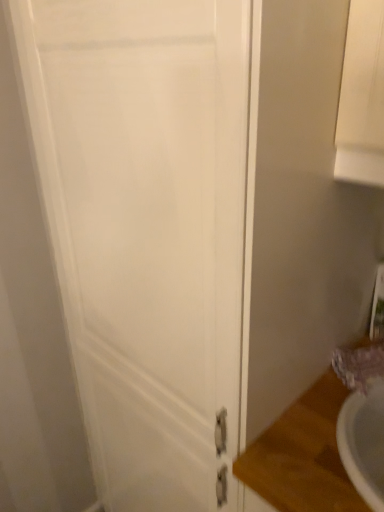
Where is `wooden counter top at lower right`? This screenshot has height=512, width=384. wooden counter top at lower right is located at coordinates (301, 455).

Who is smaller, white matte door at center or wooden counter top at lower right?

With smaller size is wooden counter top at lower right.

Can you confirm if white matte door at center is positioned to the right of wooden counter top at lower right?

No, white matte door at center is not to the right of wooden counter top at lower right.

Can you tell me how much white matte door at center and wooden counter top at lower right differ in facing direction?

white matte door at center and wooden counter top at lower right are facing 0.000102 degrees away from each other.

From the image's perspective, would you say white matte door at center is shown under wooden counter top at lower right?

No, from the image's perspective, white matte door at center is not below wooden counter top at lower right.

Considering the relative sizes of matte purple faucet at lower right and wooden counter top at lower right in the image provided, is matte purple faucet at lower right thinner than wooden counter top at lower right?

Indeed, matte purple faucet at lower right has a lesser width compared to wooden counter top at lower right.

Is matte purple faucet at lower right in front of or behind wooden counter top at lower right in the image?

matte purple faucet at lower right is behind wooden counter top at lower right.

Is wooden counter top at lower right at the back of matte purple faucet at lower right?

matte purple faucet at lower right is not turned away from wooden counter top at lower right.

Who is shorter, matte purple faucet at lower right or wooden counter top at lower right?

Standing shorter between the two is matte purple faucet at lower right.

Who is more distant, white matte door at center or matte purple faucet at lower right?

Positioned behind is matte purple faucet at lower right.

How different are the orientations of white matte door at center and matte purple faucet at lower right in degrees?

The facing directions of white matte door at center and matte purple faucet at lower right are 19.7 degrees apart.

Considering the positions of points (127, 192) and (365, 361), is point (127, 192) farther from camera compared to point (365, 361)?

No, (127, 192) is in front of (365, 361).

Is white matte door at center wider than matte purple faucet at lower right?

Indeed, white matte door at center has a greater width compared to matte purple faucet at lower right.

In the scene shown: Which is behind, matte purple faucet at lower right or white matte door at center?

Positioned behind is matte purple faucet at lower right.

What's the angular difference between matte purple faucet at lower right and white matte door at center's facing directions?

The angle between the facing direction of matte purple faucet at lower right and the facing direction of white matte door at center is 19.7 degrees.

Based on their sizes in the image, would you say matte purple faucet at lower right is bigger or smaller than white matte door at center?

Clearly, matte purple faucet at lower right is smaller in size than white matte door at center.

Could you tell me if wooden counter top at lower right is turned towards white matte door at center?

Answer: No, wooden counter top at lower right is not facing towards white matte door at center.

At what (x,y) coordinates should I click in order to perform the action: click on counter top behind the white matte door at center. Please return your answer as a coordinate pair (x, y). This screenshot has width=384, height=512. Looking at the image, I should click on (301, 455).

In the scene shown: From a real-world perspective, between wooden counter top at lower right and white matte door at center, who is vertically higher?

In real-world perspective, white matte door at center is above.

Is wooden counter top at lower right in front of or behind matte purple faucet at lower right in the image?

In the image, wooden counter top at lower right appears in front of matte purple faucet at lower right.

How distant is wooden counter top at lower right from matte purple faucet at lower right?

wooden counter top at lower right and matte purple faucet at lower right are 6.13 inches apart.

From the image's perspective, between wooden counter top at lower right and matte purple faucet at lower right, which one is located above?

matte purple faucet at lower right appears higher in the image.

In terms of height, does wooden counter top at lower right look taller or shorter compared to matte purple faucet at lower right?

Considering their sizes, wooden counter top at lower right has more height than matte purple faucet at lower right.

Where is `door above the wooden counter top at lower right (from a real-world perspective)`? door above the wooden counter top at lower right (from a real-world perspective) is located at coordinates (147, 230).

Find the location of a particular element. Image resolution: width=384 pixels, height=512 pixels. faucet behind the wooden counter top at lower right is located at coordinates (359, 365).

From the image, which object appears to be nearer to white matte door at center, matte purple faucet at lower right or wooden counter top at lower right?

wooden counter top at lower right is positioned closer to the anchor white matte door at center.

Considering their positions, is white matte door at center positioned closer to matte purple faucet at lower right than wooden counter top at lower right?

wooden counter top at lower right is closer to matte purple faucet at lower right.

From the image, which object appears to be nearer to wooden counter top at lower right, matte purple faucet at lower right or white matte door at center?

Based on the image, matte purple faucet at lower right appears to be nearer to wooden counter top at lower right.

Consider the image. Which object lies nearer to the anchor point white matte door at center, wooden counter top at lower right or matte purple faucet at lower right?

wooden counter top at lower right lies closer to white matte door at center than the other object.

When comparing their distances from matte purple faucet at lower right, does wooden counter top at lower right or white matte door at center seem further?

white matte door at center.

Estimate the real-world distances between objects in this image. Which object is closer to wooden counter top at lower right, white matte door at center or matte purple faucet at lower right?

matte purple faucet at lower right.

You are a GUI agent. You are given a task and a screenshot of the screen. Output one action in this format:
    pyautogui.click(x=<x>, y=<y>)
    Task: Click on the faucet that lies between white matte door at center and wooden counter top at lower right from top to bottom
    
    Given the screenshot: What is the action you would take?
    [x=359, y=365]